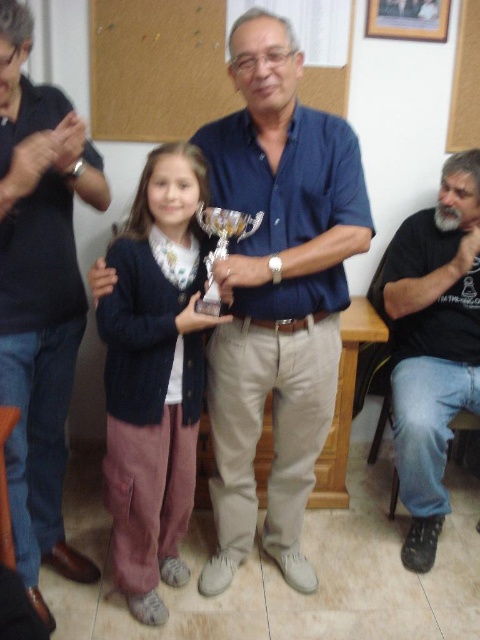
You are attending a family gathering and need to place a decorative item on a shelf. The shelf has limited vertical space. Which object between the knitted sweater at center and the wooden frame at upper center would you choose to ensure it fits vertically?

The wooden frame at upper center should be chosen because the knitted sweater at center is taller, so the wooden frame at upper center is shorter and would fit better in the limited vertical space.

You are organizing a charity event and need to arrange two shirts on a display rack. The shirts are the blue cotton shirt at center and the black cotton shirt at lower right. Based on their sizes, which shirt should you place on the wider shelf space to ensure proper display?

The blue cotton shirt at center should be placed on the wider shelf space because its width is larger than the black cotton shirt at lower right.

You are standing in the center of the image and want to hand a gift to the person wearing the blue cotton shirt at center. In which direction should you move to reach them?

The blue cotton shirt at center is located at point (x=276, y=292), so you should move towards the center of the image to reach them.